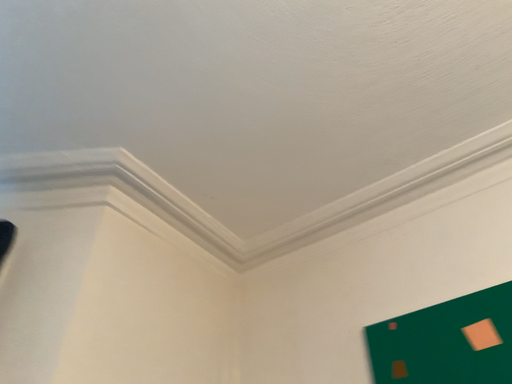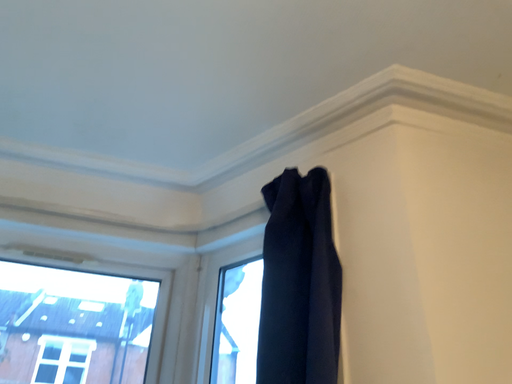
Question: Which way did the camera rotate in the video?

Choices:
 (A) rotated downward
 (B) rotated upward

Answer: (A)